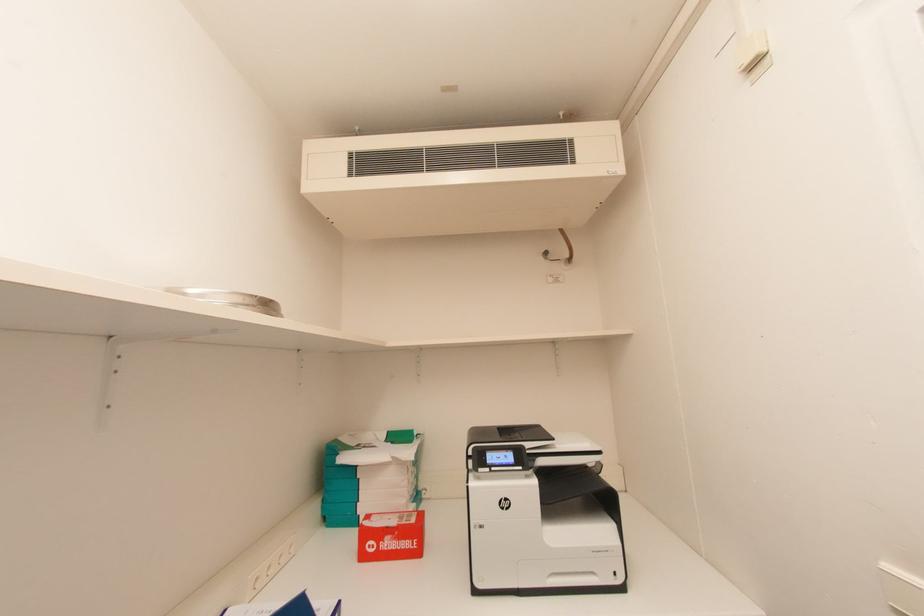
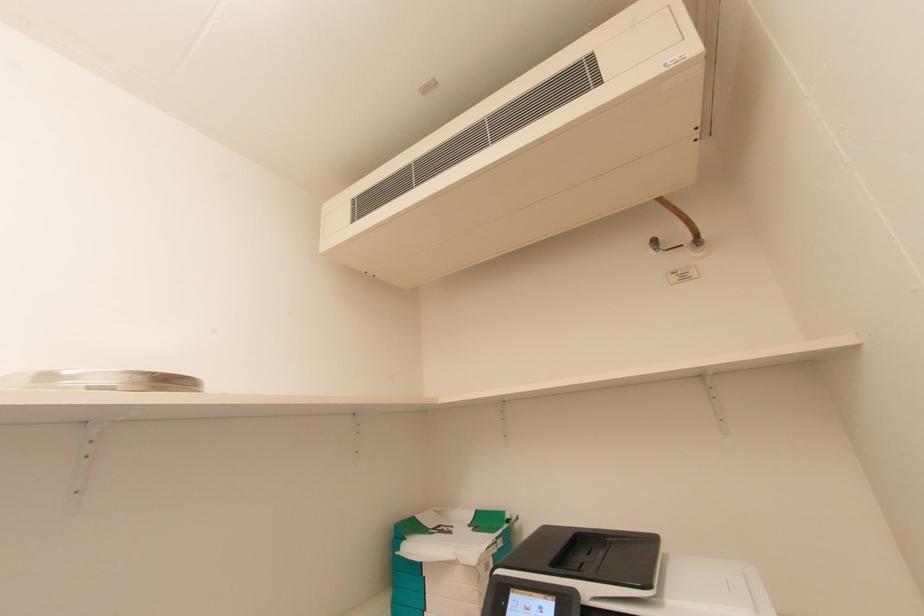
Question: The camera is either moving clockwise (left) or counter-clockwise (right) around the object. The first image is from the beginning of the video and the second image is from the end. Is the camera moving left or right when shooting the video?

Choices:
 (A) Left
 (B) Right

Answer: (B)